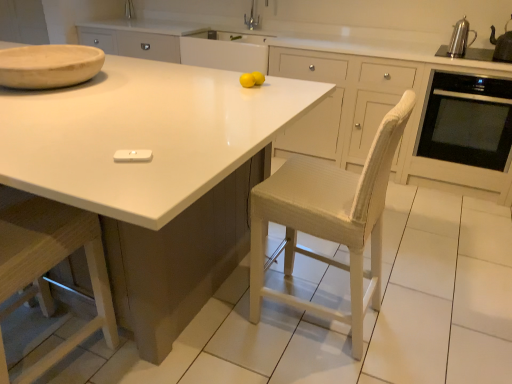
This screenshot has width=512, height=384. I want to click on vacant space situated on the left part of white matte remote control at center, the 2th appliance in the right-to-left sequence, so pos(77,158).